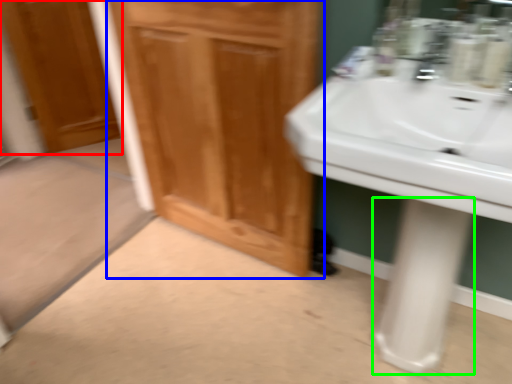
Question: Which is nearer to the door (highlighted by a red box)? bathroom cabinet (highlighted by a blue box) or pillar (highlighted by a green box).

Choices:
 (A) bathroom cabinet
 (B) pillar

Answer: (A)